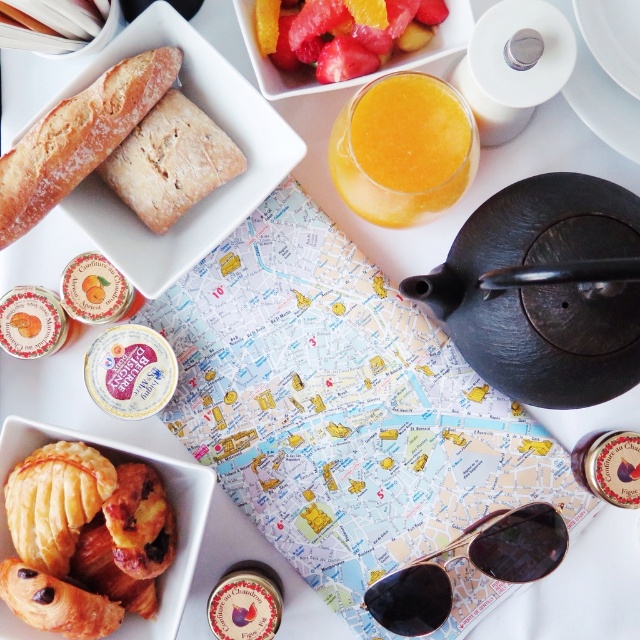
You are a chef preparing a dish and need to place a garnish between the golden brown crusty bread at upper left and the brown crumbly square at upper left. The garnish requires 1.2 inches of space. Is there enough space between them?

The golden brown crusty bread at upper left is only 1.06 inches away from the brown crumbly square at upper left, which is less than the required 1.2 inches. Therefore, there isn not enough space for the garnish.